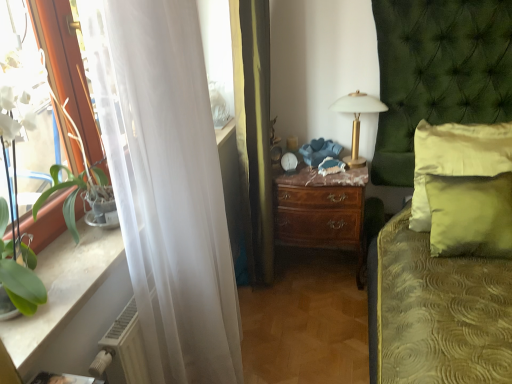
Locate an element on the screen. empty space that is ontop of brown wood nightstand at center (from a real-world perspective) is located at coordinates (323, 173).